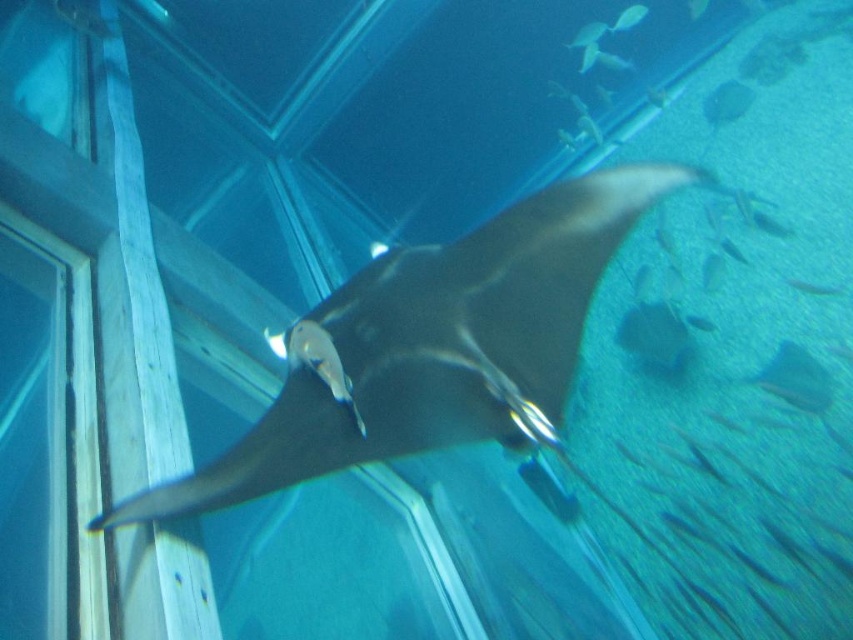
Is translucent white fish at upper center bigger than translucent blue fish at upper center?

Incorrect, translucent white fish at upper center is not larger than translucent blue fish at upper center.

Does point (596, 22) lie in front of point (610, 28)?

Yes, it is.

Identify the location of translucent white fish at upper center. (589, 35).

Which is more to the right, shiny black stingray at center or translucent blue fish at upper center?

translucent blue fish at upper center

Can you confirm if shiny black stingray at center is positioned above translucent blue fish at upper center?

Incorrect, shiny black stingray at center is not positioned above translucent blue fish at upper center.

Who is more forward, (367, 300) or (619, 28)?

Point (367, 300) is more forward.

You are a GUI agent. You are given a task and a screenshot of the screen. Output one action in this format:
    pyautogui.click(x=<x>, y=<y>)
    Task: Click on the shiny black stingray at center
    This screenshot has height=640, width=853.
    Given the screenshot: What is the action you would take?
    pyautogui.click(x=433, y=346)

Does point (445, 358) come closer to viewer compared to point (576, 36)?

Yes, point (445, 358) is in front of point (576, 36).

Consider the image. Between shiny black stingray at center and translucent white fish at upper center, which one appears on the right side from the viewer's perspective?

Positioned to the right is translucent white fish at upper center.

At what (x,y) coordinates should I click in order to perform the action: click on shiny black stingray at center. Please return your answer as a coordinate pair (x, y). This screenshot has width=853, height=640. Looking at the image, I should click on (433, 346).